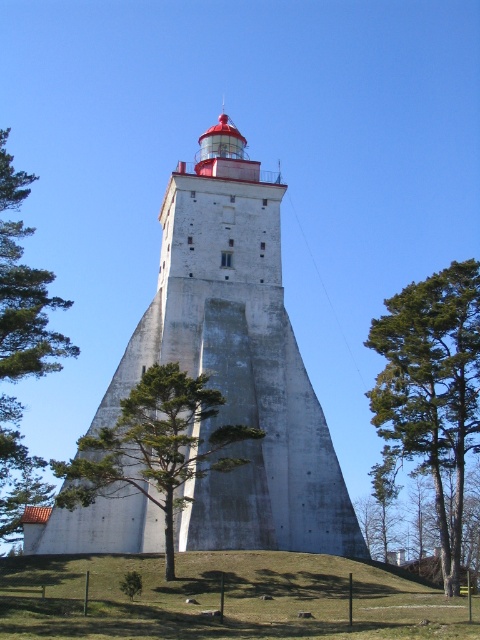
Is green grass at center further to the viewer compared to green leafy tree at left?

No, green grass at center is closer to the viewer.

Who is shorter, green grass at center or green leafy tree at left?

Standing shorter between the two is green grass at center.

I want to click on green grass at center, so click(x=224, y=598).

Can you confirm if white concrete tower at center is bigger than green textured tree at center?

Yes.

Who is taller, white concrete tower at center or green textured tree at center?

white concrete tower at center is taller.

The width and height of the screenshot is (480, 640). Find the location of `white concrete tower at center`. white concrete tower at center is located at coordinates (239, 362).

Does point (60, 572) come in front of point (429, 426)?

No, (60, 572) is behind (429, 426).

Is green grass at center to the right of green pine tree at center from the viewer's perspective?

Incorrect, green grass at center is not on the right side of green pine tree at center.

What do you see at coordinates (224, 598) in the screenshot?
I see `green grass at center` at bounding box center [224, 598].

At what (x,y) coordinates should I click in order to perform the action: click on green grass at center. Please return your answer as a coordinate pair (x, y). The height and width of the screenshot is (640, 480). Looking at the image, I should click on (224, 598).